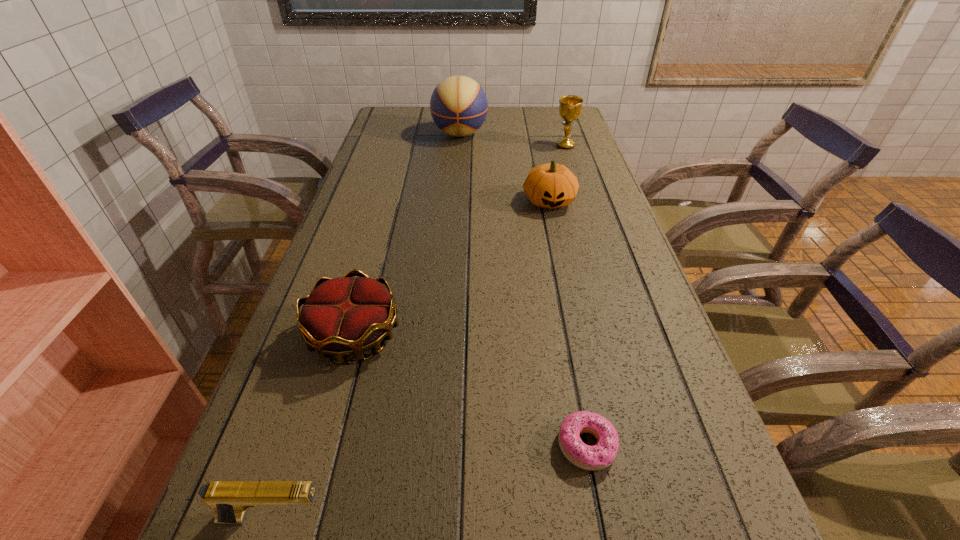
Image resolution: width=960 pixels, height=540 pixels. I want to click on empty space between the crown and the third tallest object, so click(452, 268).

This screenshot has width=960, height=540. What are the coordinates of `unoccupied area between the fourth farthest object and the nearest object` in the screenshot? It's located at (314, 427).

Find the location of `object that is the third closest to the basketball`. object that is the third closest to the basketball is located at coordinates (345, 316).

Identify the location of object that ranks as the closest to the pistol. (345, 316).

The height and width of the screenshot is (540, 960). In order to click on vacant area in the image that satisfies the following two spatial constraints: 1. on the patterned surface of the basketball; 2. at the barrel of the nearest object in this screenshot , I will do `click(430, 518)`.

Where is `vacant space that satisfies the following two spatial constraints: 1. on the patterned surface of the chalice; 2. on the left side of the basketball`? The width and height of the screenshot is (960, 540). vacant space that satisfies the following two spatial constraints: 1. on the patterned surface of the chalice; 2. on the left side of the basketball is located at coordinates (459, 145).

At what (x,y) coordinates should I click in order to perform the action: click on free space that satisfies the following two spatial constraints: 1. on the patterned surface of the tallest object; 2. on the right side of the second tallest object. Please return your answer as a coordinate pair (x, y). This screenshot has height=540, width=960. Looking at the image, I should click on (459, 145).